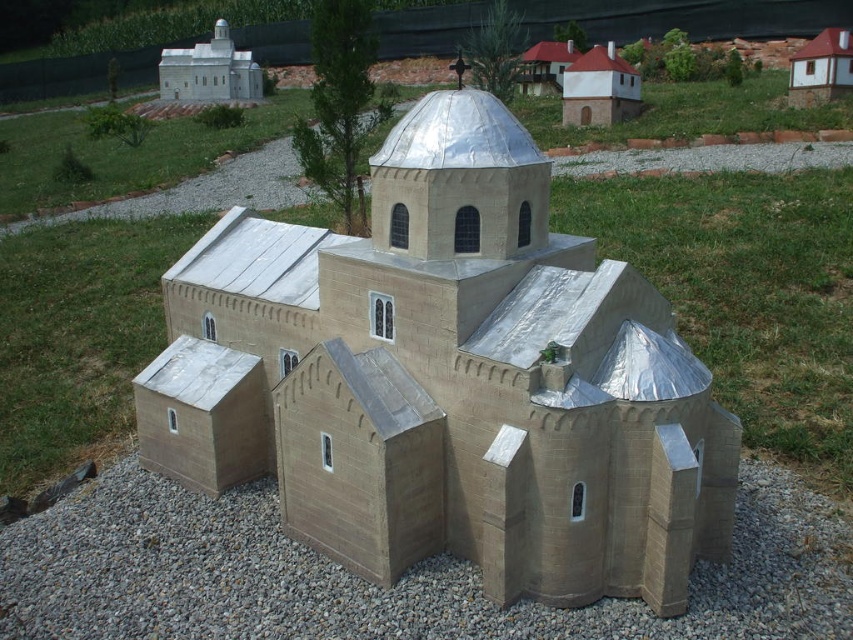
Question: Can you confirm if white matte chapel at upper left is thinner than white wood house at upper right?

Choices:
 (A) yes
 (B) no

Answer: (B)

Question: Can you confirm if matte silver church at center is positioned above gray gravel at lower center?

Choices:
 (A) no
 (B) yes

Answer: (B)

Question: Which point appears farthest from the camera in this image?

Choices:
 (A) (317, 568)
 (B) (256, 99)

Answer: (B)

Question: Which of these objects is positioned farthest from the matte white chapel at upper right?

Choices:
 (A) gray gravel at lower center
 (B) white wood house at upper right
 (C) white matte chapel at upper left
 (D) matte silver church at center

Answer: (A)

Question: Is matte silver church at center wider than white matte chapel at upper left?

Choices:
 (A) no
 (B) yes

Answer: (B)

Question: Which is nearer to the matte white chapel at upper right?

Choices:
 (A) gray gravel at lower center
 (B) white matte chapel at upper left
 (C) matte silver church at center

Answer: (B)